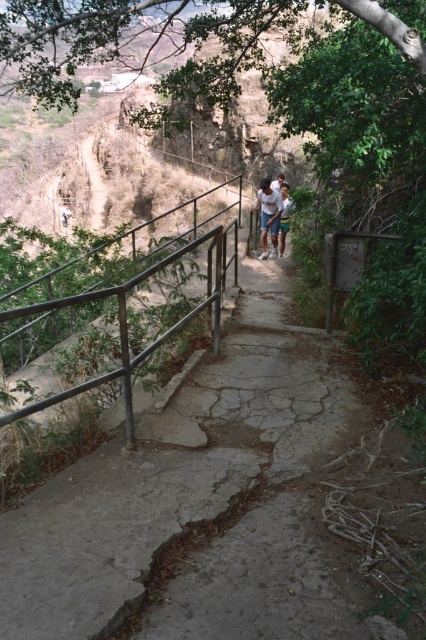
Question: Can you confirm if cracked concrete path at center is wider than metal/smooth rail at center?

Choices:
 (A) yes
 (B) no

Answer: (B)

Question: In this image, where is cracked concrete path at center located relative to light blue denim shorts at center?

Choices:
 (A) below
 (B) above

Answer: (A)

Question: Is metal/smooth rail at center smaller than light blue denim shorts at center?

Choices:
 (A) yes
 (B) no

Answer: (B)

Question: Among these objects, which one is nearest to the camera?

Choices:
 (A) light blue denim shorts at center
 (B) metal/smooth rail at center
 (C) cracked concrete path at center

Answer: (C)

Question: Which object is positioned closest to the cracked concrete path at center?

Choices:
 (A) metal/smooth rail at center
 (B) light blue denim shorts at center

Answer: (A)

Question: Which of the following is the farthest from the observer?

Choices:
 (A) light blue denim shorts at center
 (B) cracked concrete path at center
 (C) metal/smooth rail at center

Answer: (A)